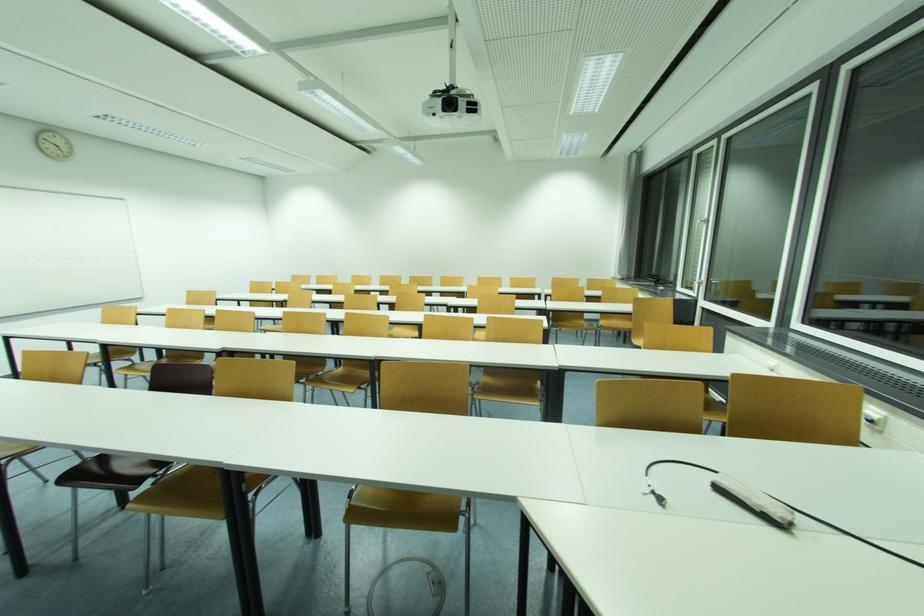
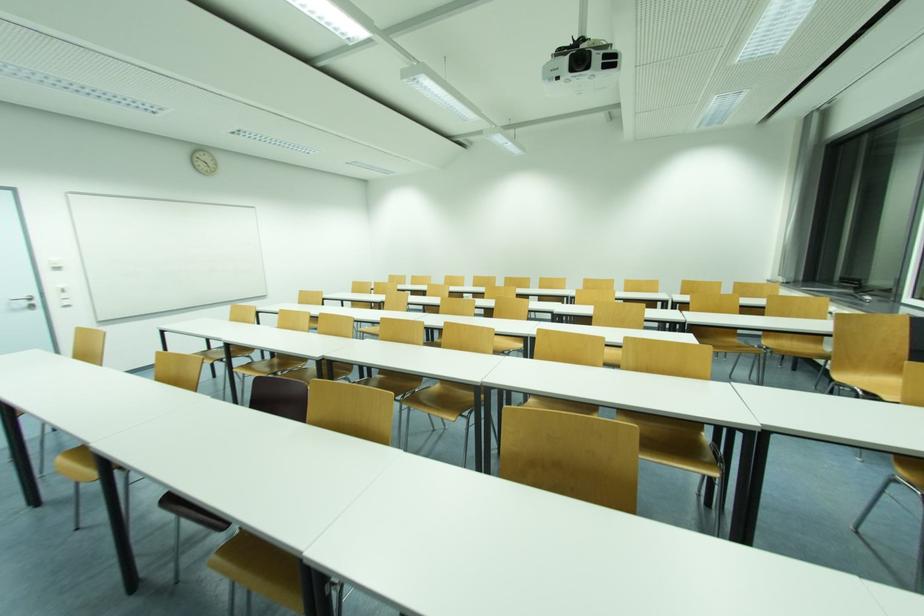
Question: How did the camera likely rotate?

Choices:
 (A) Left
 (B) Right
 (C) Up
 (D) Down

Answer: (A)